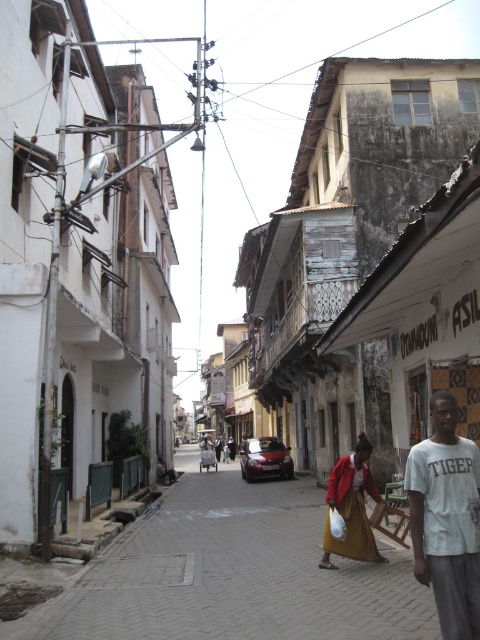
Image resolution: width=480 pixels, height=640 pixels. What do you see at coordinates (232, 572) in the screenshot?
I see `brick paved street at center` at bounding box center [232, 572].

Is brick paved street at center positioned at the back of white cotton t-shirt at lower right?

Yes, brick paved street at center is further from the viewer.

Is point (422, 593) in front of point (417, 445)?

No, (422, 593) is further to viewer.

Image resolution: width=480 pixels, height=640 pixels. In order to click on brick paved street at center in this screenshot , I will do click(x=232, y=572).

Who is more distant from viewer, (424, 474) or (354, 484)?

The point (354, 484) is behind.

Between point (414, 554) and point (359, 484), which one is positioned behind?

Positioned behind is point (359, 484).

At what (x,y) coordinates should I click in order to perform the action: click on white cotton t-shirt at lower right. Please return your answer as a coordinate pair (x, y). Looking at the image, I should click on (446, 518).

How far apart are brick paved street at center and red fabric skirt at lower center?

5.39 meters

Between point (289, 499) and point (334, 504), which one is positioned behind?

The point (289, 499) is more distant.

The width and height of the screenshot is (480, 640). What do you see at coordinates (232, 572) in the screenshot?
I see `brick paved street at center` at bounding box center [232, 572].

Identify the location of brick paved street at center. Image resolution: width=480 pixels, height=640 pixels. pos(232,572).